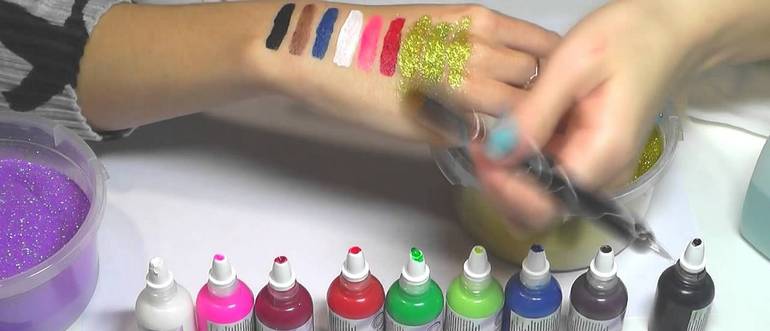
Locate an element on the screen. The image size is (770, 331). pink paint is located at coordinates (226, 300), (370, 47).